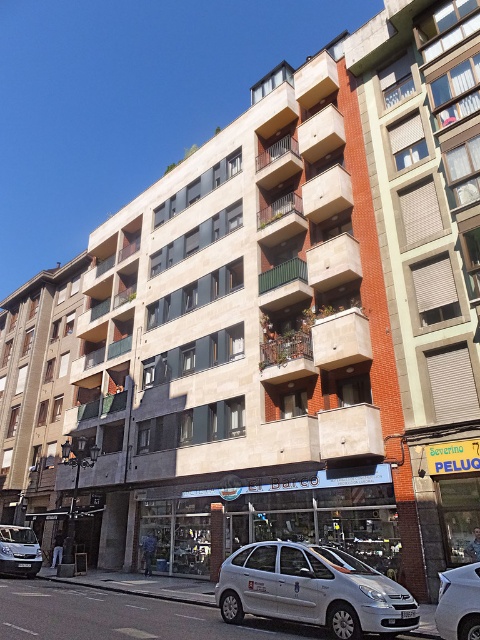
Question: Can you confirm if white matte car at lower center is positioned to the right of silver metallic car at center?

Choices:
 (A) no
 (B) yes

Answer: (A)

Question: Can you confirm if silver metallic car at center is positioned above silver metallic van at lower left?

Choices:
 (A) yes
 (B) no

Answer: (A)

Question: Which of the following is the closest to the observer?

Choices:
 (A) (454, 572)
 (B) (348, 624)
 (C) (16, 550)

Answer: (B)

Question: Which object appears farthest from the camera in this image?

Choices:
 (A) silver metallic van at lower left
 (B) white matte car at lower center
 (C) silver metallic car at center

Answer: (A)

Question: Can you confirm if white matte car at lower center is wider than silver metallic van at lower left?

Choices:
 (A) no
 (B) yes

Answer: (B)

Question: Which point is closer to the camera?

Choices:
 (A) (325, 573)
 (B) (2, 566)

Answer: (A)